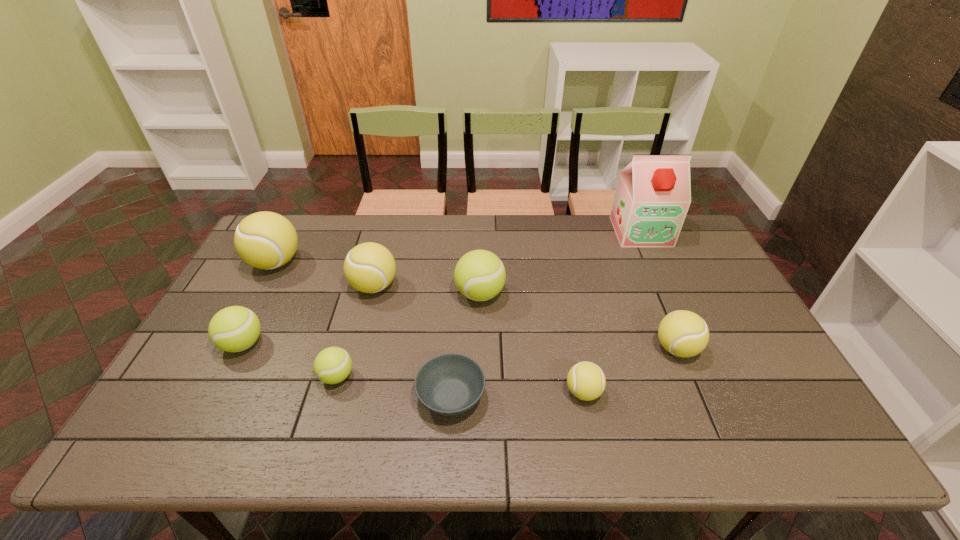
Where is `green tennis ball that is the third closest to the rightmost yellow tennis ball`? Image resolution: width=960 pixels, height=540 pixels. green tennis ball that is the third closest to the rightmost yellow tennis ball is located at coordinates (233, 329).

Identify the location of green tennis ball that stands as the second closest to the second tallest object. (332, 365).

Identify the location of free spot that satisfies the following two spatial constraints: 1. on the front side of the leftmost green tennis ball; 2. on the left side of the leftmost yellow tennis ball. The height and width of the screenshot is (540, 960). (232, 344).